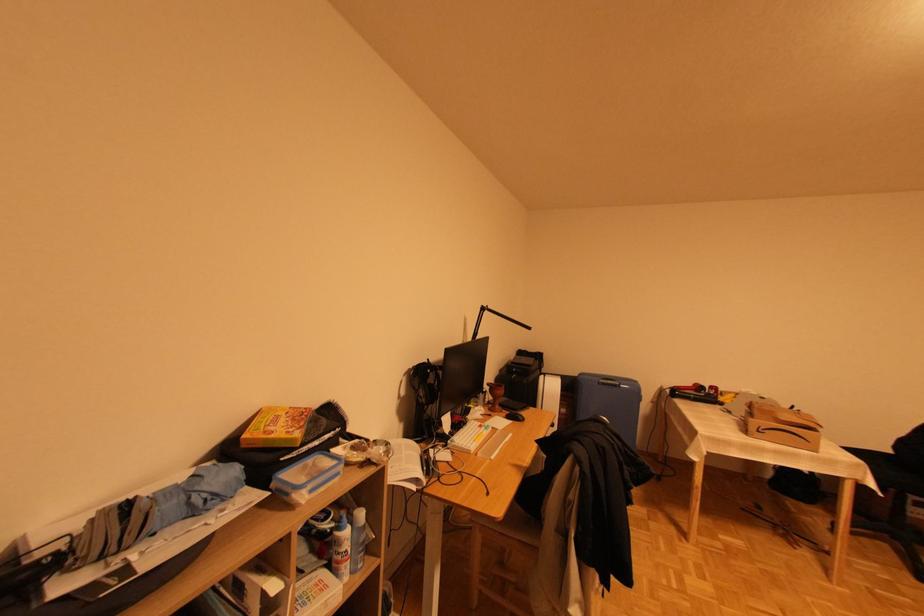
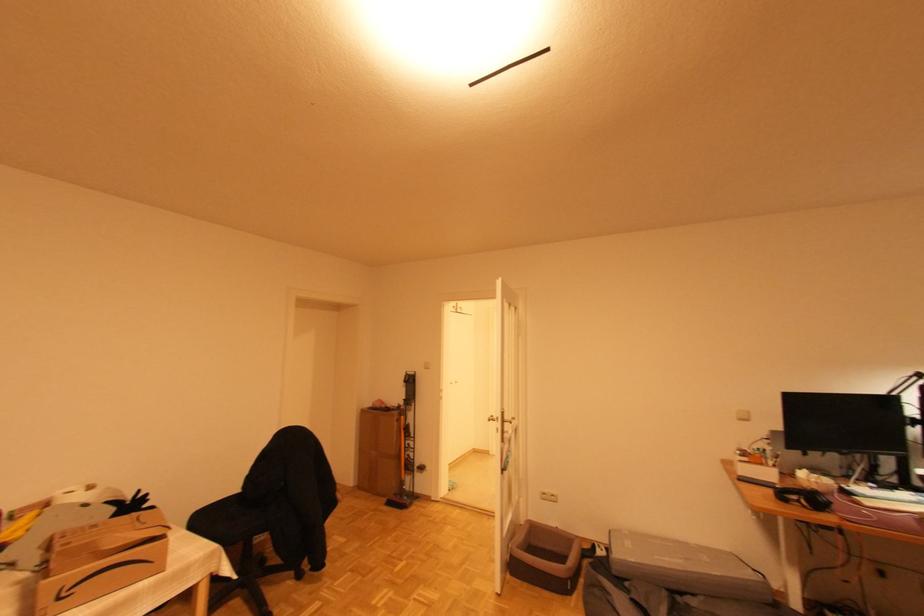
The point at (x=761, y=432) is marked in the first image. Where is the corresponding point in the second image?

(61, 600)